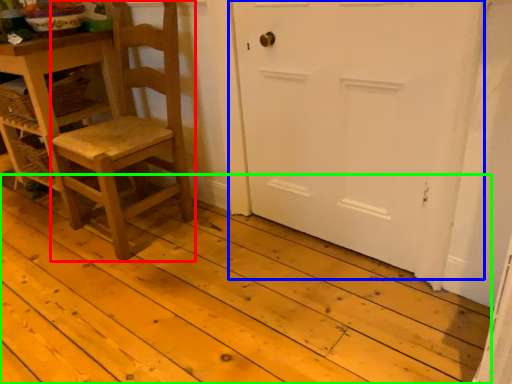
Question: Which object is positioned farthest from chair (highlighted by a red box)? Select from door (highlighted by a blue box) and plank (highlighted by a green box).

Choices:
 (A) door
 (B) plank

Answer: (A)